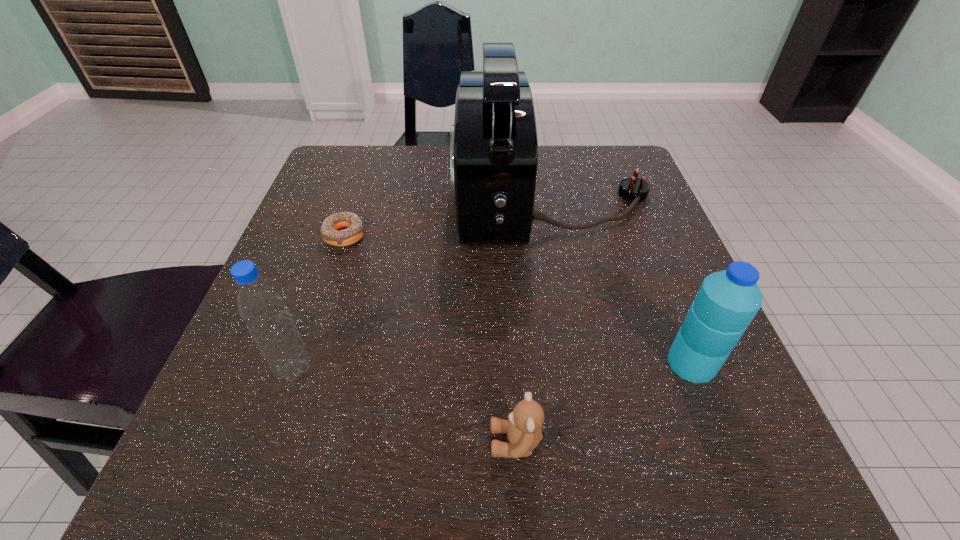
Find the location of a particular element. Image resolution: width=960 pixels, height=540 pixels. the tallest object is located at coordinates (493, 144).

You are a GUI agent. You are given a task and a screenshot of the screen. Output one action in this format:
    pyautogui.click(x=<x>, y=<y>)
    Task: Click on the left water bottle
    Image resolution: width=960 pixels, height=540 pixels.
    Given the screenshot: What is the action you would take?
    pyautogui.click(x=260, y=304)

Locate an element on the screen. The height and width of the screenshot is (540, 960). the right water bottle is located at coordinates (727, 301).

I want to click on the fourth tallest object, so click(x=523, y=428).

The width and height of the screenshot is (960, 540). I want to click on the nearest object, so click(523, 428).

Where is `the shortest object`? the shortest object is located at coordinates (355, 230).

This screenshot has height=540, width=960. I want to click on vacant space located 0.270m on the front-facing side of the tallest object, so click(329, 197).

I want to click on vacant area situated on the front-facing side of the tallest object, so click(413, 197).

Image resolution: width=960 pixels, height=540 pixels. I want to click on vacant space located on the front-facing side of the tallest object, so click(427, 197).

The image size is (960, 540). In order to click on blank space located on the back of the left water bottle in this screenshot , I will do `click(336, 247)`.